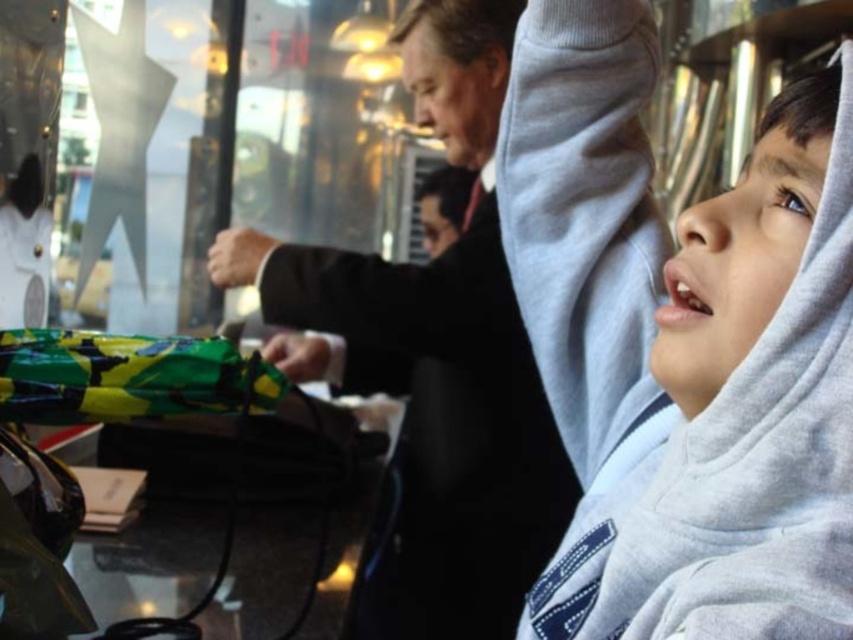
You are designing a layout for a food truck menu board. The menu board has two sections. The first section is for children and needs to be smaller. The second section is for adult meals and should be larger. Given the gray fleece hoodie at upper right represents the children section and the black matte suit at center represents the adult section, does the current size relationship between them match the required layout?

The gray fleece hoodie at upper right is smaller than the black matte suit at center, so yes, the current size relationship between them matches the required layout where the children section is smaller and the adult section is larger.

You are standing at the point labeled as point (x=621, y=36) in the image. If you want to move 34.04 inches towards the viewer, where would you end up?

Moving 34.04 inches from point (x=621, y=36) towards the viewer would bring you to the viewer, as they are exactly 34.04 inches apart.